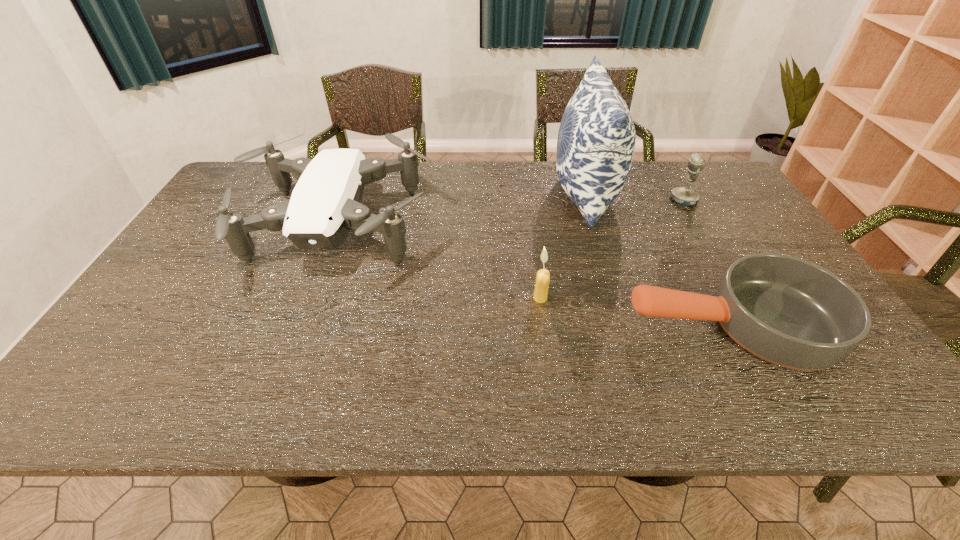
Identify the location of free point that satisfies the following two spatial constraints: 1. on the front surface of the tallest object; 2. on the front side of the candle. (616, 298).